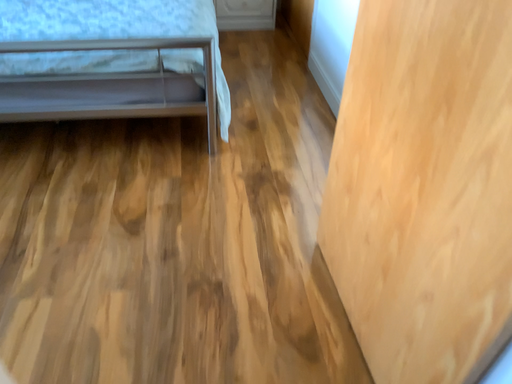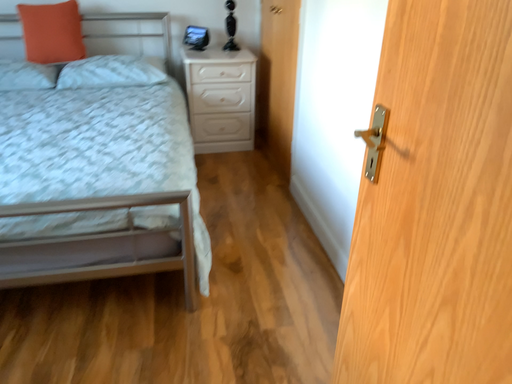
Question: Which way did the camera rotate in the video?

Choices:
 (A) rotated upward
 (B) rotated downward

Answer: (A)